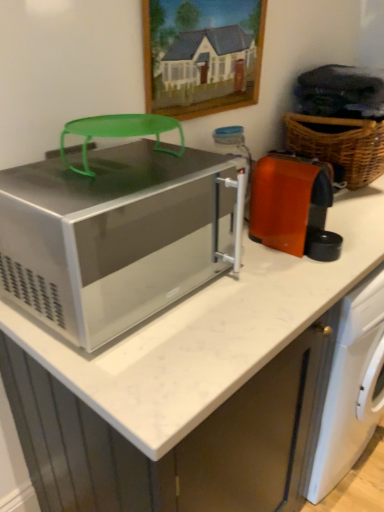
Question: Choose the correct answer: Is satin silver microwave at center inside white marble countertop at center or outside it?

Choices:
 (A) inside
 (B) outside

Answer: (B)

Question: From the image's perspective, is satin silver microwave at center positioned above or below white marble countertop at center?

Choices:
 (A) below
 (B) above

Answer: (B)

Question: Considering the real-world distances, which object is closest to the satin silver microwave at center?

Choices:
 (A) orange glossy coffee maker at right
 (B) wooden framed painting at upper center
 (C) woven brown basket at right
 (D) white marble countertop at center

Answer: (D)

Question: Which object is positioned closest to the orange glossy coffee maker at right?

Choices:
 (A) white marble countertop at center
 (B) wooden framed painting at upper center
 (C) woven brown basket at right
 (D) satin silver microwave at center

Answer: (D)